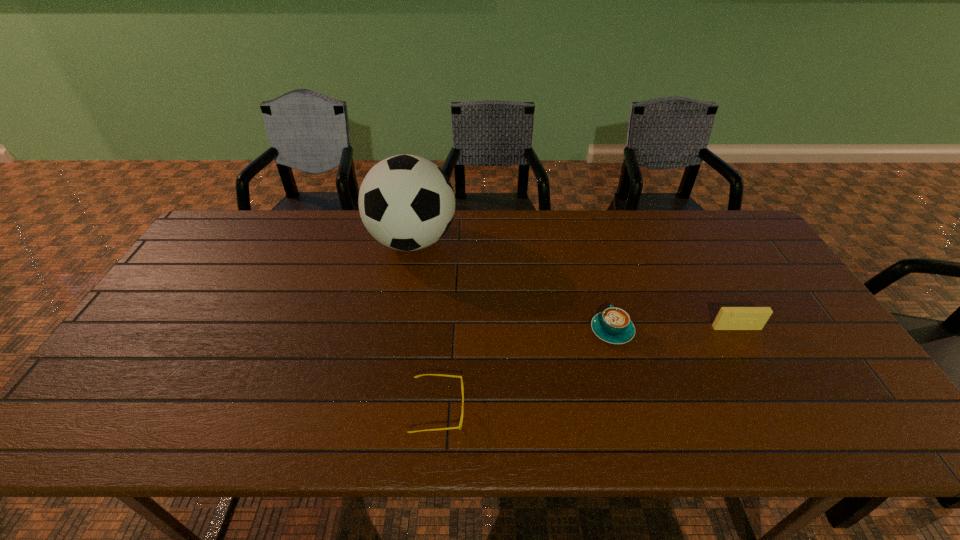
At what (x,y) coordinates should I click in order to perform the action: click on vacant area between the shortest object and the second object from right to left. Please return your answer as a coordinate pair (x, y). Image resolution: width=960 pixels, height=540 pixels. Looking at the image, I should click on click(x=525, y=370).

Identify the location of object that can be found as the third closest to the rightmost object. (406, 202).

Find the location of a particular element. This screenshot has height=540, width=960. object identified as the second closest to the videotape is located at coordinates (459, 427).

Identify the location of free space in the image that satisfies the following two spatial constraints: 1. at the front of the videotape with spools; 2. in front of the lenses of the shortest object. (781, 410).